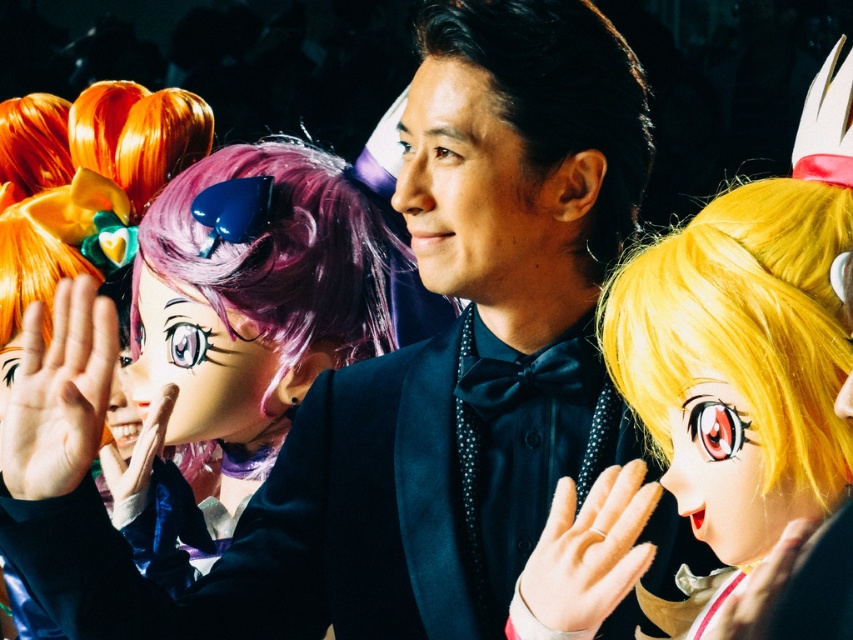
You are a photographer at the event and want to capture a closeup of the shiny blonde wig at center. The camera you are using has a minimum focusing distance of 4 feet. Can you take the photo without moving closer than 4 feet?

The shiny blonde wig at center is 4.01 feet from viewer, so you can take the photo without moving closer than 4 feet because the distance is just slightly over the minimum focusing distance.

You are a photographer at the event and want to capture a photo focusing on the shiny blonde wig at center and the smooth skin face at center. Which one is located to the right side of the other?

The shiny blonde wig at center is positioned on the right side of smooth skin face at center.